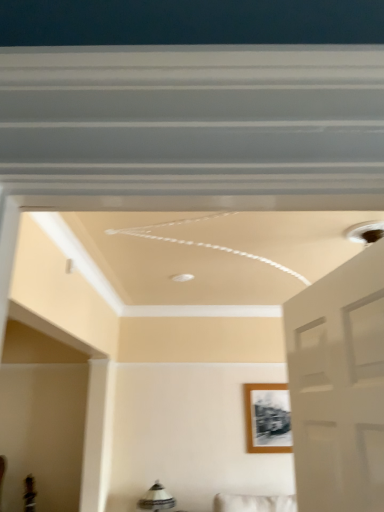
Question: In terms of width, does wooden photo frame at center look wider or thinner when compared to white glossy lampshade at lower center?

Choices:
 (A) wide
 (B) thin

Answer: (B)

Question: From their relative heights in the image, would you say wooden photo frame at center is taller or shorter than white glossy lampshade at lower center?

Choices:
 (A) tall
 (B) short

Answer: (A)

Question: In the image, is wooden photo frame at center positioned in front of or behind white glossy lampshade at lower center?

Choices:
 (A) front
 (B) behind

Answer: (B)

Question: Based on their positions, is white glossy lampshade at lower center located to the left or right of wooden photo frame at center?

Choices:
 (A) right
 (B) left

Answer: (B)

Question: Which is correct: white glossy lampshade at lower center is inside wooden photo frame at center, or outside of it?

Choices:
 (A) inside
 (B) outside

Answer: (B)

Question: Considering the positions of point (147, 495) and point (281, 445), is point (147, 495) closer or farther from the camera than point (281, 445)?

Choices:
 (A) farther
 (B) closer

Answer: (B)

Question: From a real-world perspective, is white glossy lampshade at lower center above or below wooden photo frame at center?

Choices:
 (A) above
 (B) below

Answer: (B)